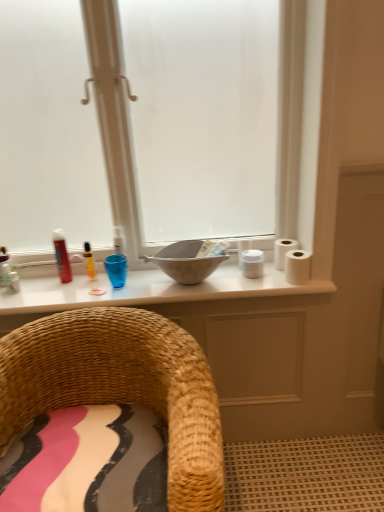
What do you see at coordinates (121, 386) in the screenshot?
I see `woven straw chair at lower left` at bounding box center [121, 386].

The image size is (384, 512). I want to click on yellow plastic marker at upper center, which ranks as the first toiletry in right-to-left order, so click(x=89, y=261).

This screenshot has width=384, height=512. Describe the element at coordinates (89, 261) in the screenshot. I see `yellow plastic marker at upper center, which ranks as the first toiletry in right-to-left order` at that location.

In order to click on matte red can at left, acting as the 2th toiletry starting from the right in this screenshot , I will do `click(61, 256)`.

Identify the location of white matte toilet paper at right, the 2th toilet paper viewed from the front. (282, 251).

Where is `matte white countertop at center`? The height and width of the screenshot is (512, 384). matte white countertop at center is located at coordinates (151, 290).

Consider the image. Is matte white countertop at center positioned far away from yellow plastic marker at upper center, which is counted as the second toiletry, starting from the left?

Actually, matte white countertop at center and yellow plastic marker at upper center, which is counted as the second toiletry, starting from the left, are a little close together.

Considering the relative sizes of matte white countertop at center and yellow plastic marker at upper center, which ranks as the first toiletry in right-to-left order, in the image provided, is matte white countertop at center thinner than yellow plastic marker at upper center, which ranks as the first toiletry in right-to-left order,?

Incorrect, the width of matte white countertop at center is not less than that of yellow plastic marker at upper center, which ranks as the first toiletry in right-to-left order.

Where is `counter top that is in front of the yellow plastic marker at upper center, which ranks as the first toiletry in right-to-left order`? counter top that is in front of the yellow plastic marker at upper center, which ranks as the first toiletry in right-to-left order is located at coordinates (151, 290).

Can you tell me how much matte white countertop at center and yellow plastic marker at upper center, which is counted as the second toiletry, starting from the left, differ in facing direction?

The angular difference between matte white countertop at center and yellow plastic marker at upper center, which is counted as the second toiletry, starting from the left, is 0.0146 degrees.

Which of these two, matte glass window at center or white matte toilet paper at right, arranged as the 2th toilet paper when viewed from the back, stands shorter?

Standing shorter between the two is white matte toilet paper at right, arranged as the 2th toilet paper when viewed from the back.

Looking at their sizes, would you say matte glass window at center is wider or thinner than white matte toilet paper at right, the 1th toilet paper from the front?

Clearly, matte glass window at center has more width compared to white matte toilet paper at right, the 1th toilet paper from the front.

Does matte glass window at center have a larger size compared to white matte toilet paper at right, the 1th toilet paper from the front?

Correct, matte glass window at center is larger in size than white matte toilet paper at right, the 1th toilet paper from the front.

Choose the correct answer: Is matte glass window at center inside white matte toilet paper at right, arranged as the 2th toilet paper when viewed from the back, or outside it?

The correct answer is: outside.

Considering the positions of objects yellow plastic marker at upper center, which is counted as the second toiletry, starting from the left, and woven straw chair at lower left in the image provided, who is behind, yellow plastic marker at upper center, which is counted as the second toiletry, starting from the left, or woven straw chair at lower left?

yellow plastic marker at upper center, which is counted as the second toiletry, starting from the left, is further from the camera.

Which object is positioned more to the right, yellow plastic marker at upper center, which is counted as the second toiletry, starting from the left, or woven straw chair at lower left?

From the viewer's perspective, woven straw chair at lower left appears more on the right side.

How different are the orientations of yellow plastic marker at upper center, which ranks as the first toiletry in right-to-left order, and woven straw chair at lower left in degrees?

0.0301 degrees.

Is yellow plastic marker at upper center, which is counted as the second toiletry, starting from the left, next to woven straw chair at lower left?

There is a gap between yellow plastic marker at upper center, which is counted as the second toiletry, starting from the left, and woven straw chair at lower left.

Which is correct: matte white countertop at center is inside matte red can at left, acting as the 2th toiletry starting from the right, or outside of it?

The correct answer is: outside.

Which is in front, matte white countertop at center or matte red can at left, acting as the 2th toiletry starting from the right?

Positioned in front is matte white countertop at center.

Can you see matte white countertop at center touching matte red can at left, acting as the 2th toiletry starting from the right?

No, matte white countertop at center is not with matte red can at left, acting as the 2th toiletry starting from the right.

Can you confirm if matte white countertop at center is shorter than matte red can at left, acting as the 2th toiletry starting from the right?

Yes.

From the image's perspective, which is below, matte white countertop at center or white matte toilet paper at right, the 1th toilet paper from the front?

matte white countertop at center appears lower in the image.

Considering their positions, is matte white countertop at center located in front of or behind white matte toilet paper at right, arranged as the 2th toilet paper when viewed from the back?

In the image, matte white countertop at center appears behind white matte toilet paper at right, arranged as the 2th toilet paper when viewed from the back.

Consider the image. Considering the relative positions of matte white countertop at center and white matte toilet paper at right, the 1th toilet paper from the front, in the image provided, is matte white countertop at center to the right of white matte toilet paper at right, the 1th toilet paper from the front, from the viewer's perspective?

No, matte white countertop at center is not to the right of white matte toilet paper at right, the 1th toilet paper from the front.

Considering the relative sizes of matte red can at left, the 1th toiletry viewed from the left, and matte white countertop at center in the image provided, is matte red can at left, the 1th toiletry viewed from the left, smaller than matte white countertop at center?

Correct, matte red can at left, the 1th toiletry viewed from the left, occupies less space than matte white countertop at center.

Between matte red can at left, acting as the 2th toiletry starting from the right, and matte white countertop at center, which one has larger width?

matte white countertop at center is wider.

Could you tell me if matte red can at left, acting as the 2th toiletry starting from the right, is turned towards matte white countertop at center?

No, matte red can at left, acting as the 2th toiletry starting from the right, does not turn towards matte white countertop at center.

Can you confirm if white matte toilet paper at right, the first toilet paper viewed from the back, is positioned to the right of matte white countertop at center?

Yes, white matte toilet paper at right, the first toilet paper viewed from the back, is to the right of matte white countertop at center.

From a real-world perspective, which object rests below the other?

In real-world perspective, matte white countertop at center is lower.

How distant is white matte toilet paper at right, the first toilet paper viewed from the back, from matte white countertop at center?

white matte toilet paper at right, the first toilet paper viewed from the back, is 18.06 inches away from matte white countertop at center.

Which object is closer to the camera, white matte toilet paper at right, the 2th toilet paper viewed from the front, or matte white countertop at center?

matte white countertop at center is more forward.

At what (x,y) coordinates should I click in order to perform the action: click on counter top that is below the yellow plastic marker at upper center, which ranks as the first toiletry in right-to-left order (from the image's perspective). Please return your answer as a coordinate pair (x, y). The image size is (384, 512). Looking at the image, I should click on (151, 290).

Identify the location of window in front of the white matte toilet paper at right, the 1th toilet paper from the front. This screenshot has width=384, height=512. (48, 135).

From the image, which object appears to be farther from matte red can at left, the 1th toiletry viewed from the left, white matte toilet paper at right, the 2th toilet paper viewed from the front, or white matte toilet paper at right, arranged as the 2th toilet paper when viewed from the back?

Based on the image, white matte toilet paper at right, arranged as the 2th toilet paper when viewed from the back, appears to be further to matte red can at left, the 1th toiletry viewed from the left.

Which object lies nearer to the anchor point yellow plastic marker at upper center, which ranks as the first toiletry in right-to-left order, matte white countertop at center or white matte toilet paper at right, the first toilet paper viewed from the back?

The object closer to yellow plastic marker at upper center, which ranks as the first toiletry in right-to-left order, is matte white countertop at center.

From the image, which object appears to be nearer to white matte toilet paper at right, the 1th toilet paper from the front, matte glass window at center or matte gray bowl at center?

matte gray bowl at center is closer to white matte toilet paper at right, the 1th toilet paper from the front.

Looking at the image, which one is located closer to yellow plastic marker at upper center, which ranks as the first toiletry in right-to-left order, woven straw chair at lower left or white matte toilet paper at right, the 2th toilet paper viewed from the front?

Among the two, woven straw chair at lower left is located nearer to yellow plastic marker at upper center, which ranks as the first toiletry in right-to-left order.

Estimate the real-world distances between objects in this image. Which object is closer to matte gray bowl at center, matte glass window at center or woven straw chair at lower left?

woven straw chair at lower left is positioned closer to the anchor matte gray bowl at center.

Which object lies nearer to the anchor point white matte toilet paper at right, the 2th toilet paper viewed from the front, matte gray bowl at center or matte white countertop at center?

The object closer to white matte toilet paper at right, the 2th toilet paper viewed from the front, is matte gray bowl at center.

Which object lies further to the anchor point matte white countertop at center, matte gray bowl at center or woven straw chair at lower left?

woven straw chair at lower left lies further to matte white countertop at center than the other object.

Which object lies further to the anchor point yellow plastic marker at upper center, which is counted as the second toiletry, starting from the left, matte glass window at center or woven straw chair at lower left?

The object further to yellow plastic marker at upper center, which is counted as the second toiletry, starting from the left, is woven straw chair at lower left.

Find the location of a particular element. The image size is (384, 512). counter top situated between matte glass window at center and white matte toilet paper at right, the 2th toilet paper viewed from the front, from left to right is located at coordinates (151, 290).

Locate an element on the screen. counter top located between woven straw chair at lower left and white matte toilet paper at right, the first toilet paper viewed from the back, in the depth direction is located at coordinates pyautogui.click(x=151, y=290).

I want to click on sink located between matte white countertop at center and white matte toilet paper at right, the 1th toilet paper from the front, in the left-right direction, so click(189, 260).

This screenshot has height=512, width=384. What are the coordinates of `sink between woven straw chair at lower left and matte white countertop at center in the front-back direction` in the screenshot? It's located at (189, 260).